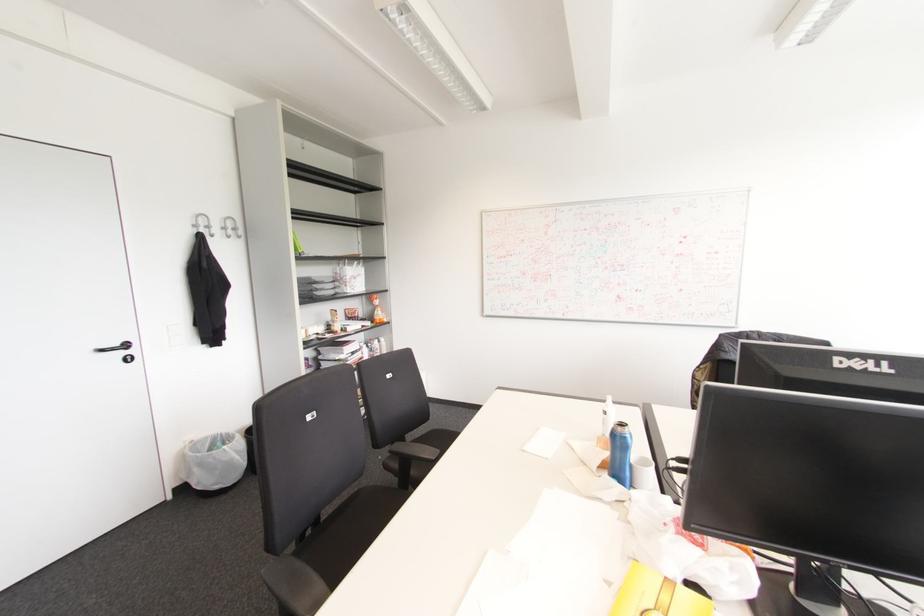
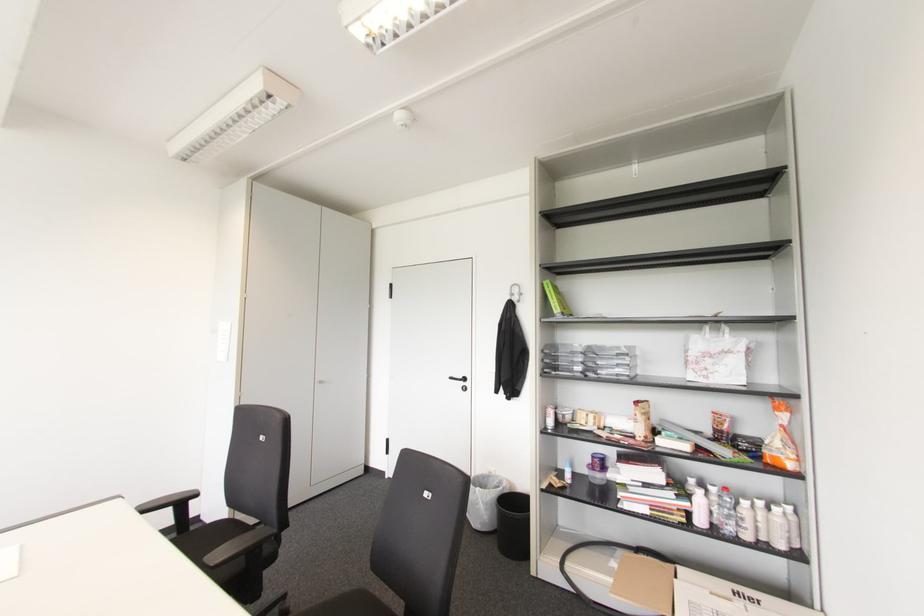
Locate, in the second image, the point that corresponds to point 126,345 in the first image.

(464, 379)